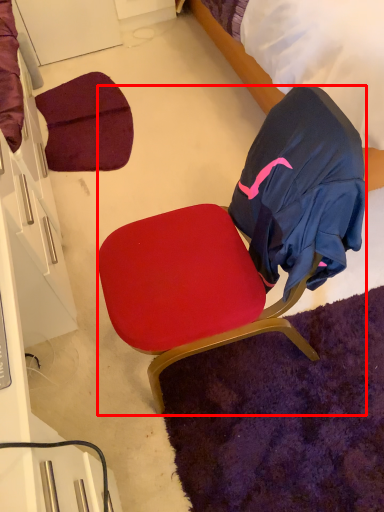
Question: Where is chair (annotated by the red box) located in relation to bed in the image?

Choices:
 (A) right
 (B) left

Answer: (B)